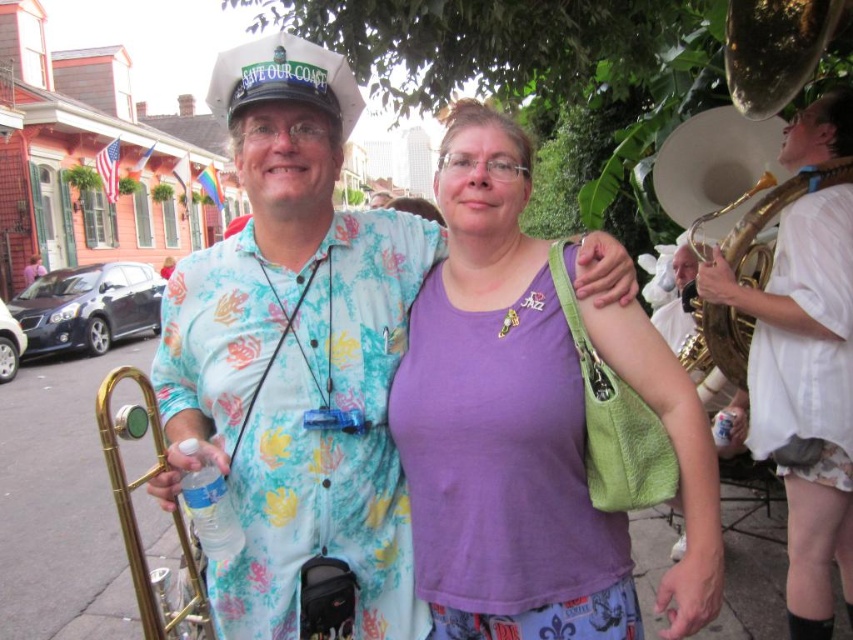
Question: Considering the real-world distances, which object is closest to the purple fabric shirt at center?

Choices:
 (A) floral print shirt at center
 (B) gold brass trumpet at lower left
 (C) white glossy saxophone at right
 (D) gold brass trumpet at right

Answer: (A)

Question: Does gold brass trumpet at lower left appear under gold brass trumpet at right?

Choices:
 (A) no
 (B) yes

Answer: (B)

Question: Which point is closer to the camera taking this photo?

Choices:
 (A) (750, 241)
 (B) (154, 637)

Answer: (B)

Question: Is purple fabric shirt at center in front of gold brass trumpet at right?

Choices:
 (A) yes
 (B) no

Answer: (A)

Question: Which point is closer to the camera taking this photo?

Choices:
 (A) (169, 625)
 (B) (712, 618)
 (C) (698, 317)

Answer: (A)

Question: Can you confirm if floral print shirt at center is positioned to the right of purple fabric shirt at center?

Choices:
 (A) no
 (B) yes

Answer: (A)